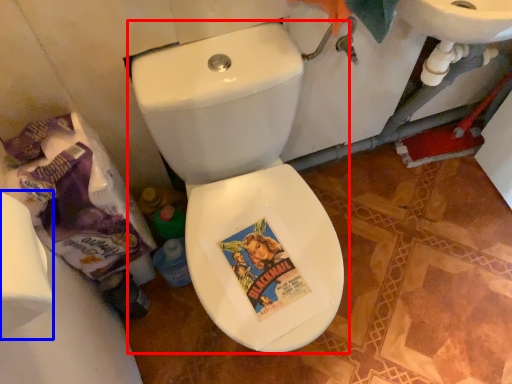
Question: Which point is closer to the camera, toilet (highlighted by a red box) or toilet paper (highlighted by a blue box)?

Choices:
 (A) toilet
 (B) toilet paper

Answer: (B)